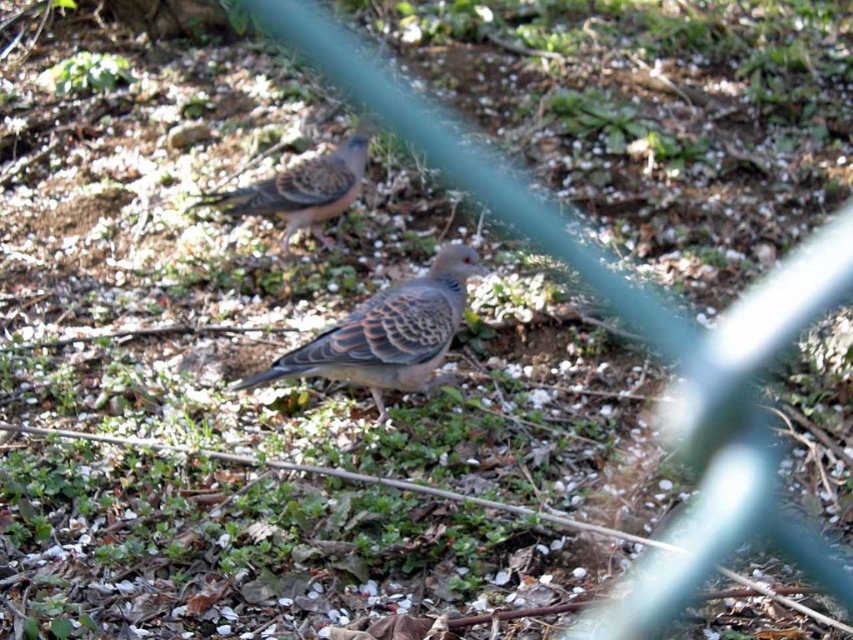
You are a birdwatcher observing two birds in a garden. You notice the speckled feathered pigeon at center and the speckled feathered bird at center. Which of these two birds is larger?

The speckled feathered bird at center is larger than the speckled feathered pigeon at center.

You are a photographer aiming to capture both the speckled feathered pigeon at center and the speckled feathered bird at center in a single shot. Based on their positions, which bird should you focus on first to ensure both are in frame?

The speckled feathered pigeon at center is below the speckled feathered bird at center, so focusing on the speckled feathered bird at center first will ensure both are in frame as the pigeon is positioned lower.